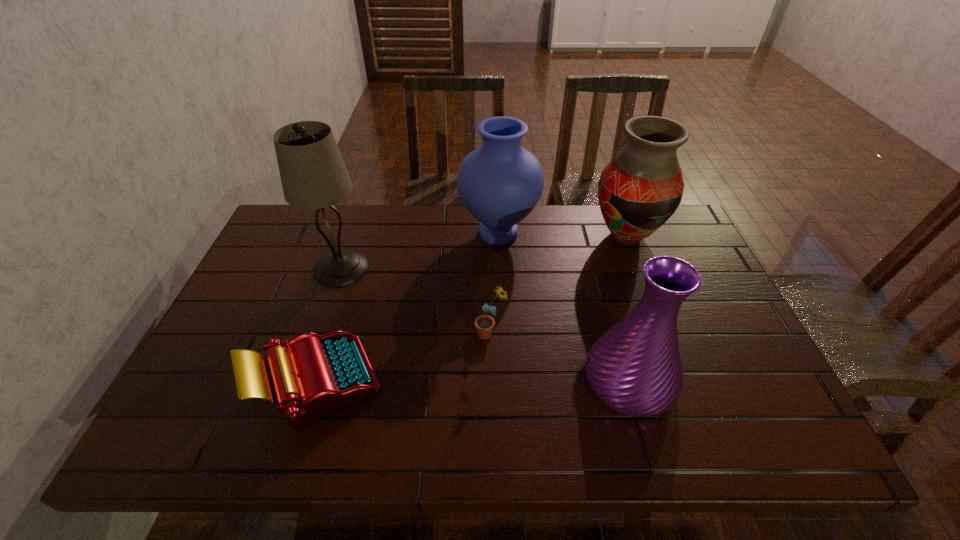
Where is `vacant space at the near edge`? vacant space at the near edge is located at coordinates (605, 438).

Image resolution: width=960 pixels, height=540 pixels. In the image, there is a desktop. What are the coordinates of `vacant space at the left edge` in the screenshot? It's located at (244, 329).

In the image, there is a desktop. Find the location of `free space at the far left corner`. free space at the far left corner is located at coordinates (275, 229).

Identify the location of empty space between the lampshade and the typewriter. (329, 325).

This screenshot has width=960, height=540. I want to click on unoccupied area between the leftmost vase and the shortest object, so click(x=408, y=307).

Identify the location of vacant area that lies between the shortest object and the lampshade. The width and height of the screenshot is (960, 540). (329, 325).

Where is `vacant area that lies between the nearest vase and the leftmost vase`? The height and width of the screenshot is (540, 960). vacant area that lies between the nearest vase and the leftmost vase is located at coordinates (564, 307).

Identify the location of free space between the sunflower and the typewriter. Image resolution: width=960 pixels, height=540 pixels. (404, 357).

Locate an element on the screen. vacant area that lies between the typewriter and the leftmost vase is located at coordinates (408, 307).

At what (x,y) coordinates should I click in order to perform the action: click on the fifth closest object to the leftmost vase. Please return your answer as a coordinate pair (x, y). The image size is (960, 540). Looking at the image, I should click on (315, 375).